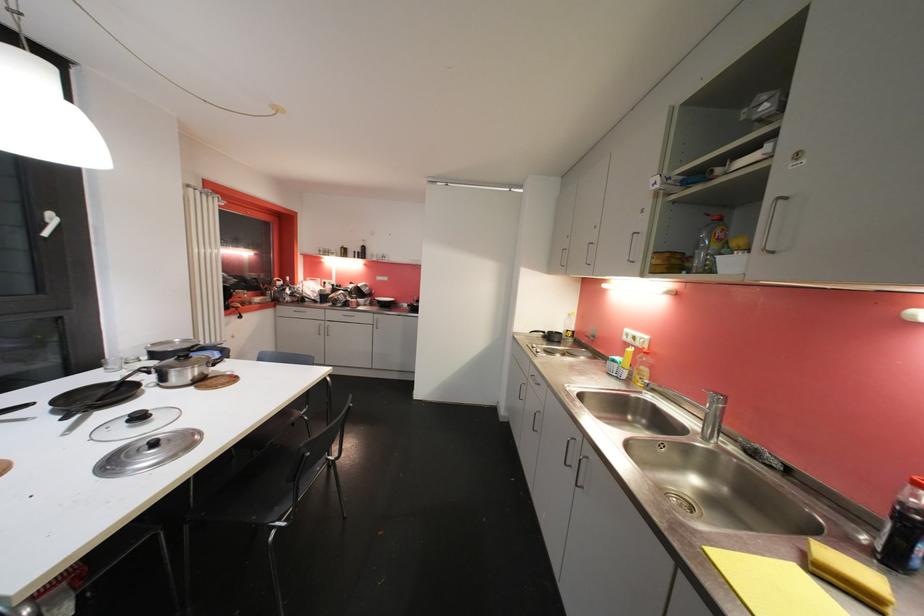
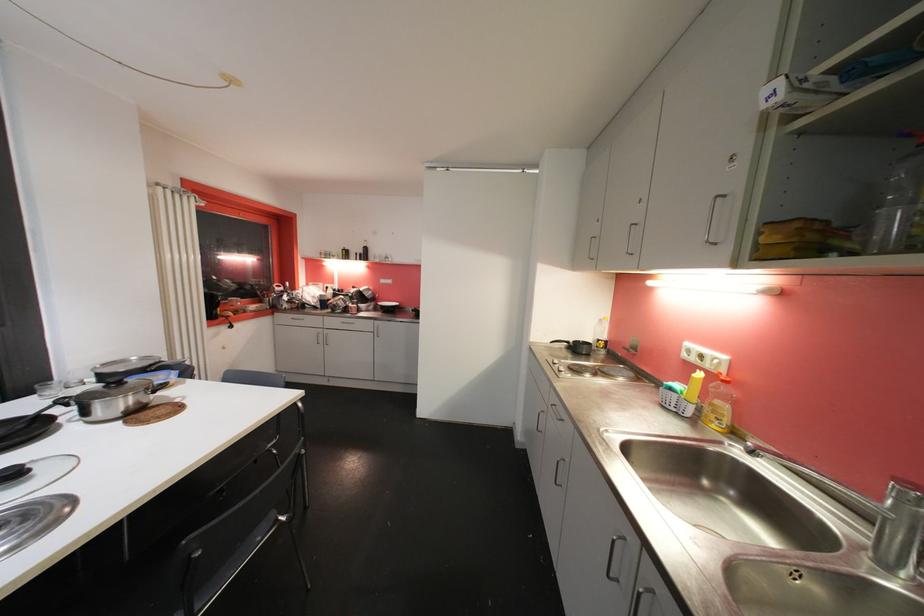
Question: The images are taken continuously from a first-person perspective. In which direction are you moving?

Choices:
 (A) Left
 (B) Right
 (C) Forward
 (D) Backward

Answer: (C)